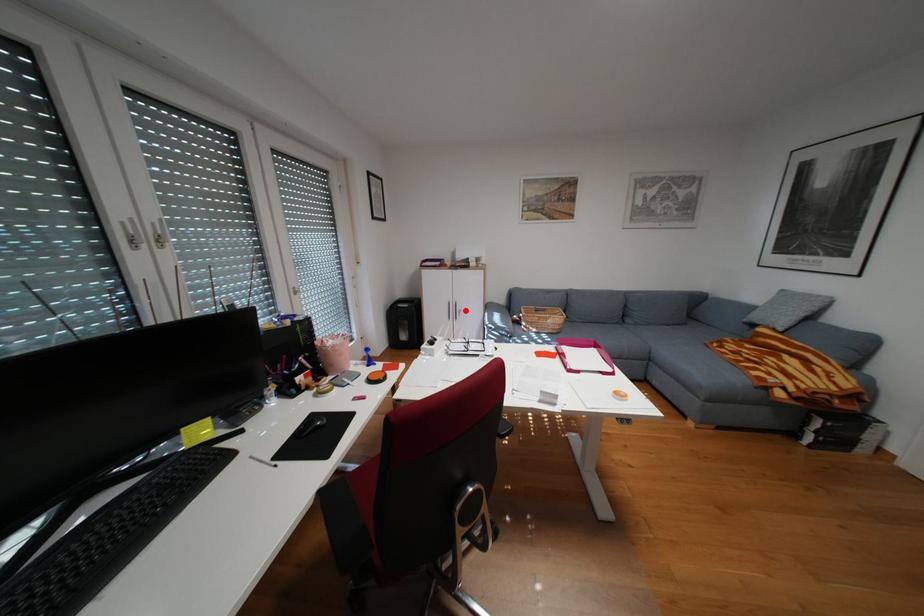
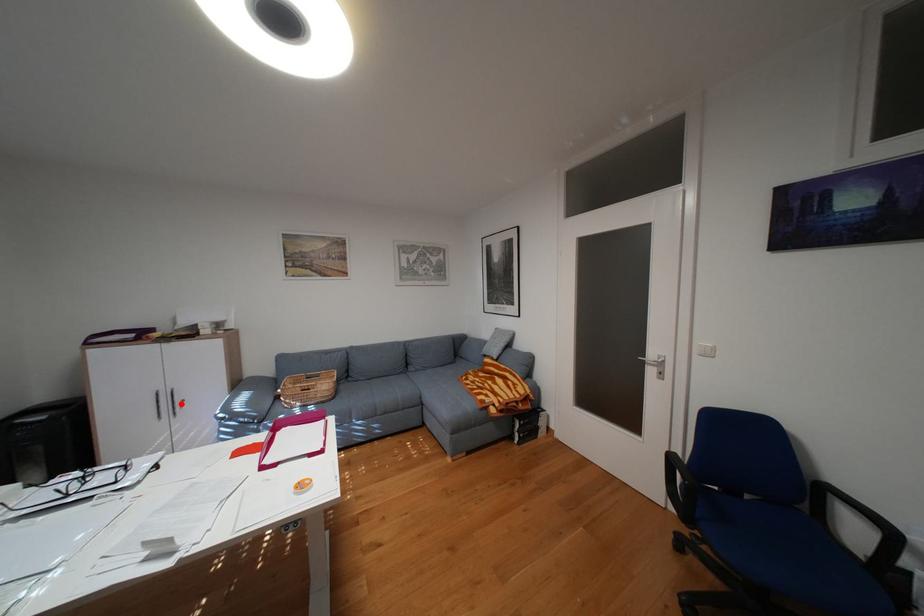
I am providing you with two images of the same scene from different viewpoints. A red point is marked on the first image and another point is marked on the second image. Does the point marked in image1 correspond to the same location as the one in image2?

Yes